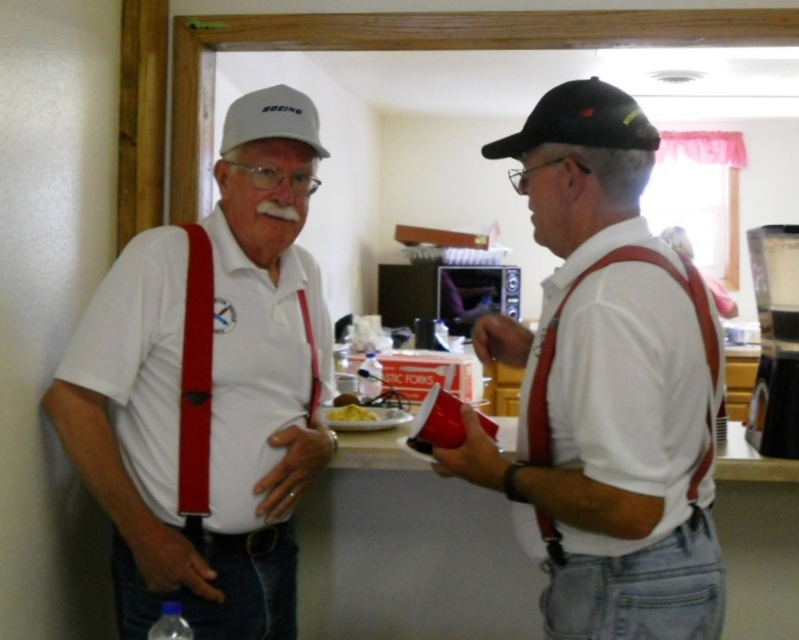
Is black matte baseball cap at upper right closer to camera compared to white matte baseball cap at upper left?

Yes, black matte baseball cap at upper right is closer to the viewer.

Can you confirm if black matte baseball cap at upper right is positioned to the right of white matte baseball cap at upper left?

Yes, black matte baseball cap at upper right is to the right of white matte baseball cap at upper left.

Describe the element at coordinates (579, 122) in the screenshot. I see `black matte baseball cap at upper right` at that location.

Where is `black matte baseball cap at upper right`? The image size is (799, 640). black matte baseball cap at upper right is located at coordinates (579, 122).

Which of these two, red leather suspenders at right or white matte baseball cap at upper left, stands taller?

red leather suspenders at right

Find the location of a particular element. This screenshot has height=640, width=799. red leather suspenders at right is located at coordinates (618, 385).

Identify the location of red leather suspenders at right. (618, 385).

Between white matte shirt at center and yellow matte food at center, which one appears on the right side from the viewer's perspective?

Positioned to the right is yellow matte food at center.

Which is in front, point (146, 374) or point (348, 403)?

Point (146, 374)

Locate an element on the screen. white matte shirt at center is located at coordinates (209, 388).